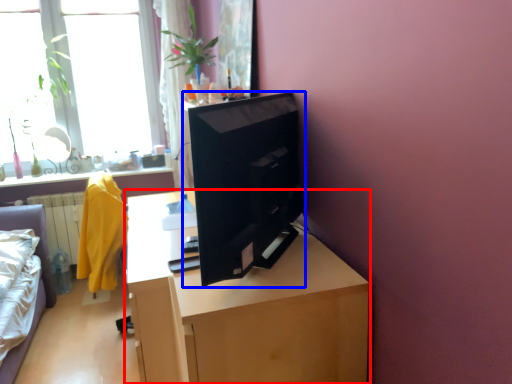
Question: Among these objects, which one is nearest to the camera, desk (highlighted by a red box) or computer (highlighted by a blue box)?

Choices:
 (A) desk
 (B) computer

Answer: (B)